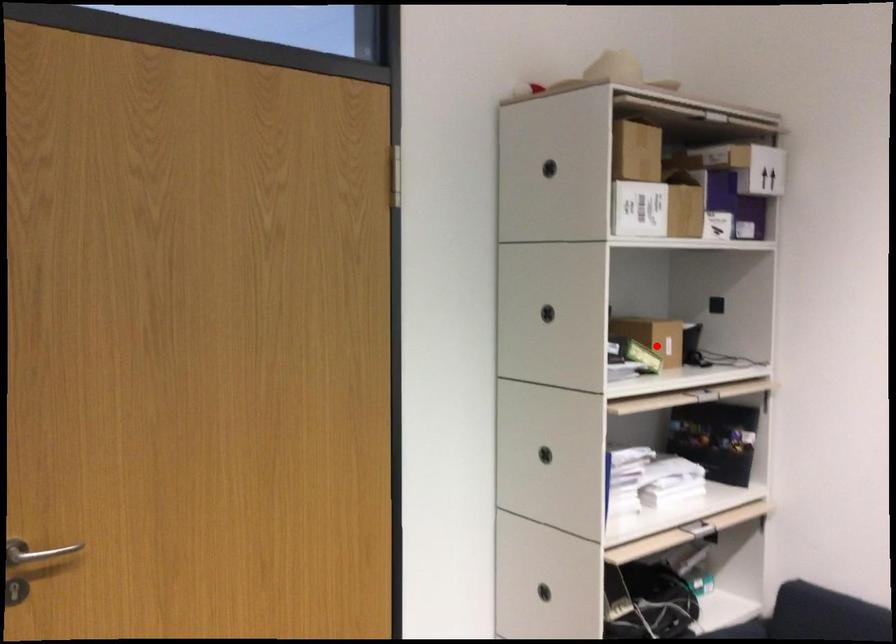
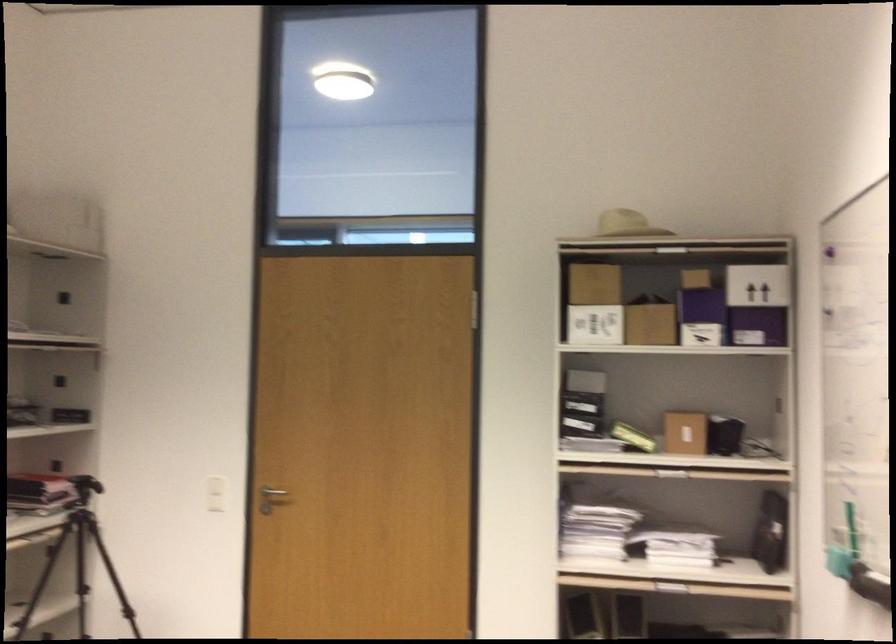
Question: I am providing you with two images of the same scene from different viewpoints. A red point is marked on the first image. Is the red point's position out of view in image 2?

Choices:
 (A) Yes
 (B) No

Answer: (B)